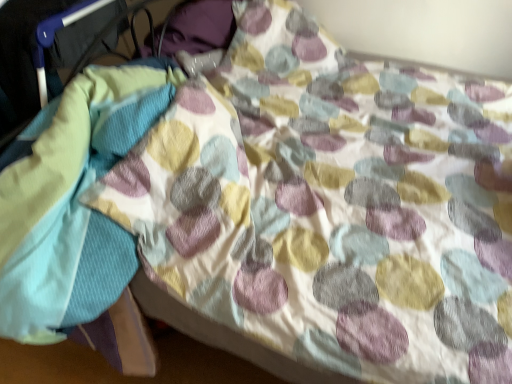
Image resolution: width=512 pixels, height=384 pixels. What are the coordinates of `pastel polka dot fabric at left` in the screenshot? It's located at (72, 200).

Measure the distance between point (8, 327) and camera.

Point (8, 327) and camera are 88.90 centimeters apart from each other.

What do you see at coordinates (72, 200) in the screenshot? I see `pastel polka dot fabric at left` at bounding box center [72, 200].

Find the location of a particular element. Image resolution: width=512 pixels, height=384 pixels. pastel polka dot fabric at left is located at coordinates (72, 200).